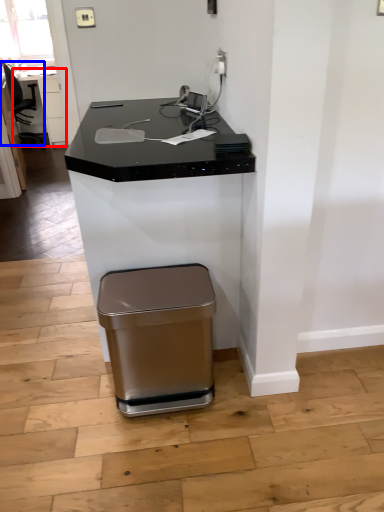
Question: Which point is closer to the camera, table (highlighted by a red box) or swivel chair (highlighted by a blue box)?

Choices:
 (A) table
 (B) swivel chair

Answer: (B)